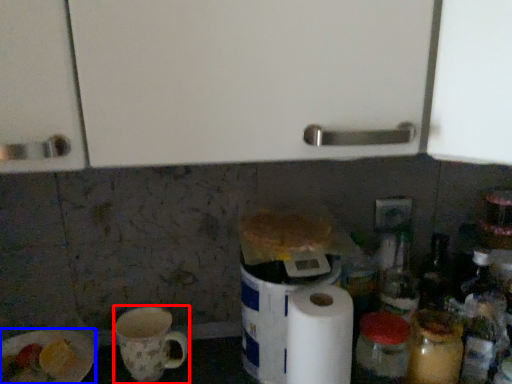
Question: Which of the following is the farthest to the observer, mug (highlighted by a red box) or paper plate (highlighted by a blue box)?

Choices:
 (A) mug
 (B) paper plate

Answer: (A)